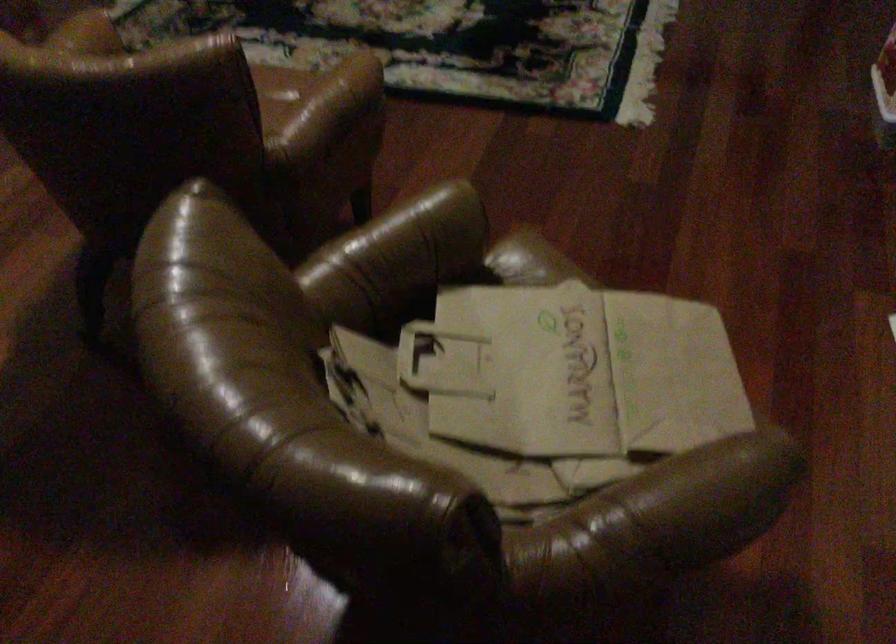
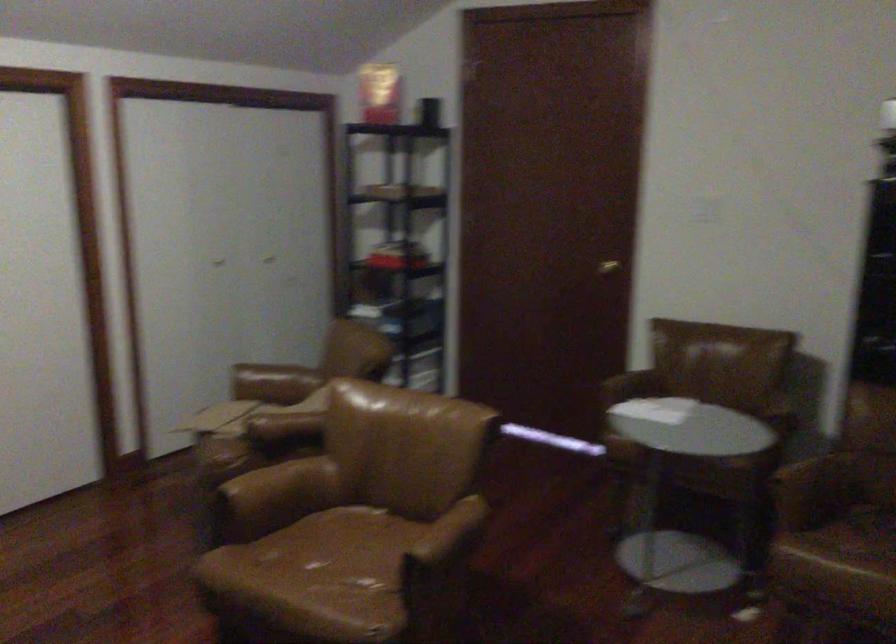
In the second image, find the point that corresponds to point 306,126 in the first image.

(280, 484)